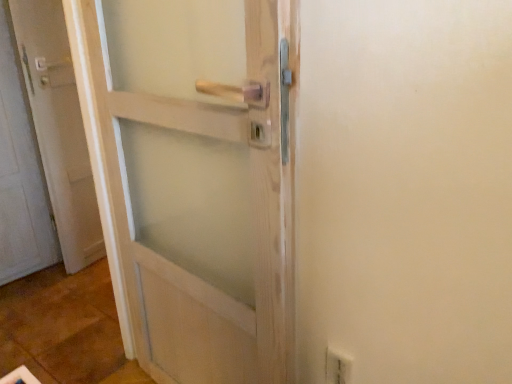
Measure the distance between white plastic electric outlet at lower right and camera.

white plastic electric outlet at lower right is 97.30 centimeters from camera.

This screenshot has width=512, height=384. What do you see at coordinates (337, 367) in the screenshot? I see `white plastic electric outlet at lower right` at bounding box center [337, 367].

This screenshot has width=512, height=384. Find the location of `white plastic electric outlet at lower right`. white plastic electric outlet at lower right is located at coordinates (337, 367).

Where is `white matte door at left`? The height and width of the screenshot is (384, 512). white matte door at left is located at coordinates (59, 128).

Image resolution: width=512 pixels, height=384 pixels. Describe the element at coordinates (59, 128) in the screenshot. I see `white matte door at left` at that location.

Find the location of a particular element. The width and height of the screenshot is (512, 384). white plastic electric outlet at lower right is located at coordinates 337,367.

Is white plastic electric outlet at lower right to the right of white matte door at left from the viewer's perspective?

Yes.

Does white plastic electric outlet at lower right come behind white matte door at left?

No, it is not.

Considering the points (329, 382) and (56, 212), which point is in front, point (329, 382) or point (56, 212)?

The point (329, 382) is closer.

From the image's perspective, is white plastic electric outlet at lower right above white matte door at left?

No, from the image's perspective, white plastic electric outlet at lower right is not on top of white matte door at left.

From a real-world perspective, is white plastic electric outlet at lower right on white matte door at left?

No, from a real-world perspective, white plastic electric outlet at lower right is not on top of white matte door at left.

Between white plastic electric outlet at lower right and white matte door at left, which one has larger width?

With larger width is white matte door at left.

Is white plastic electric outlet at lower right shorter than white matte door at left?

Correct, white plastic electric outlet at lower right is not as tall as white matte door at left.

In terms of size, does white plastic electric outlet at lower right appear bigger or smaller than white matte door at left?

Considering their sizes, white plastic electric outlet at lower right takes up less space than white matte door at left.

Choose the correct answer: Is white plastic electric outlet at lower right inside white matte door at left or outside it?

white plastic electric outlet at lower right lies outside white matte door at left.

Looking at this image, is white plastic electric outlet at lower right beside white matte door at left?

No, white plastic electric outlet at lower right is not beside white matte door at left.

Does white plastic electric outlet at lower right turn towards white matte door at left?

No, white plastic electric outlet at lower right is not turned towards white matte door at left.

The width and height of the screenshot is (512, 384). In order to click on door on the left of white plastic electric outlet at lower right in this screenshot , I will do click(59, 128).

In the image, is white matte door at left on the left side or the right side of white plastic electric outlet at lower right?

Clearly, white matte door at left is on the left of white plastic electric outlet at lower right in the image.

Which is behind, white matte door at left or white plastic electric outlet at lower right?

white matte door at left is behind.

Does point (58, 159) come in front of point (339, 380)?

No, it is behind (339, 380).

From the image's perspective, is white matte door at left beneath white plastic electric outlet at lower right?

No.

From a real-world perspective, which object stands above the other?

white matte door at left.

In terms of width, does white matte door at left look wider or thinner when compared to white plastic electric outlet at lower right?

In the image, white matte door at left appears to be wider than white plastic electric outlet at lower right.

Is white matte door at left shorter than white plastic electric outlet at lower right?

No.

Can you confirm if white matte door at left is bigger than white plastic electric outlet at lower right?

Correct, white matte door at left is larger in size than white plastic electric outlet at lower right.

Is white plastic electric outlet at lower right completely or partially inside white matte door at left?

Definitely not — white plastic electric outlet at lower right is not inside white matte door at left.

Would you say white matte door at left is a long distance from white plastic electric outlet at lower right?

Yes, white matte door at left is far from white plastic electric outlet at lower right.

Consider the image. Could you tell me if white matte door at left is facing white plastic electric outlet at lower right?

No, white matte door at left is not oriented towards white plastic electric outlet at lower right.

Can you tell me how much white matte door at left and white plastic electric outlet at lower right differ in facing direction?

101 degrees separate the facing orientations of white matte door at left and white plastic electric outlet at lower right.

The width and height of the screenshot is (512, 384). Find the location of `door above the white plastic electric outlet at lower right (from a real-world perspective)`. door above the white plastic electric outlet at lower right (from a real-world perspective) is located at coordinates (59, 128).

I want to click on door that is behind the white plastic electric outlet at lower right, so click(59, 128).

The image size is (512, 384). In order to click on electric outlet below the white matte door at left (from a real-world perspective) in this screenshot , I will do `click(337, 367)`.